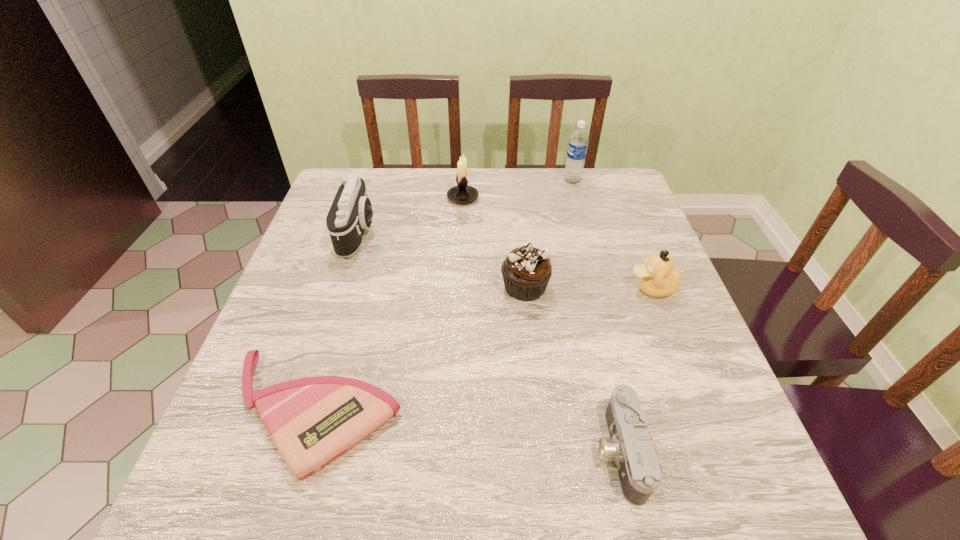
Find the location of `water bottle`. water bottle is located at coordinates (578, 143).

This screenshot has width=960, height=540. Identify the location of the farthest object. [x=578, y=143].

Find the location of a particular element. Image resolution: width=960 pixels, height=540 pixels. the third object from left to right is located at coordinates (462, 193).

Identify the location of the farther camera. Image resolution: width=960 pixels, height=540 pixels. (351, 213).

Locate an element on the screen. the left camera is located at coordinates (351, 213).

Find the location of `cupcake`. cupcake is located at coordinates (526, 271).

Find the location of `duckling`. duckling is located at coordinates (657, 278).

Identify the location of the shorter camera. Image resolution: width=960 pixels, height=540 pixels. (631, 447).

Image resolution: width=960 pixels, height=540 pixels. What are the coordinates of `the nearer camera` in the screenshot? It's located at (631, 447).

You are a GUI agent. You are given a task and a screenshot of the screen. Output one action in this format:
    pyautogui.click(x=<x>, y=<y>)
    Task: Click on the shortest object
    Image resolution: width=960 pixels, height=540 pixels.
    Given the screenshot: What is the action you would take?
    pyautogui.click(x=312, y=421)